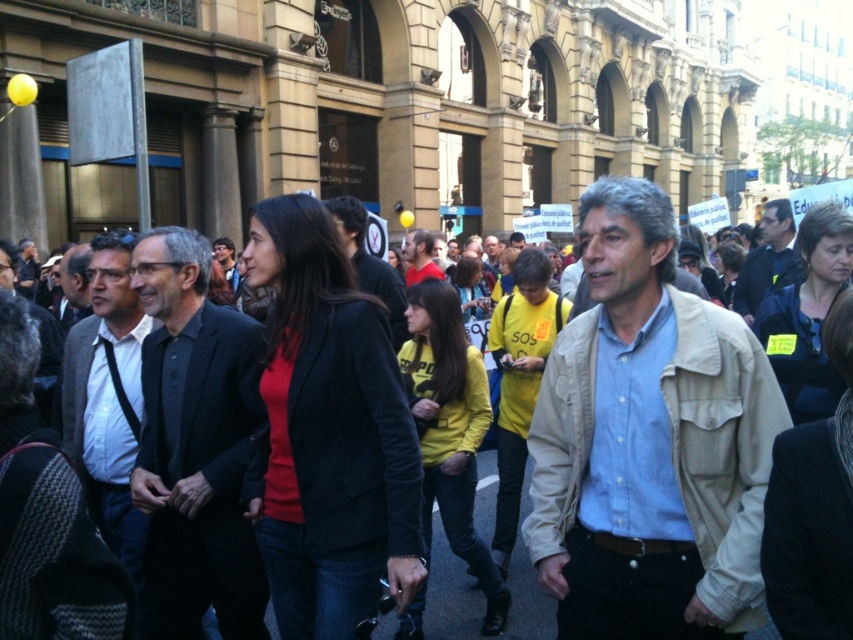
Question: Is matte black jacket at center to the left of matte red shirt at center from the viewer's perspective?

Choices:
 (A) yes
 (B) no

Answer: (A)

Question: Which object is the farthest from the dark blue shirt at center?

Choices:
 (A) dark gray suit at left
 (B) light beige jacket at center
 (C) matte red shirt at center

Answer: (A)

Question: Which of the following is the closest to the observer?

Choices:
 (A) light beige jacket at center
 (B) beige textured jacket at center

Answer: (B)

Question: Which of the following is the closest to the observer?

Choices:
 (A) dark gray suit at left
 (B) matte red shirt at center
 (C) beige textured jacket at center
 (D) yellow shirt at center

Answer: (C)

Question: Is beige textured jacket at center below dark gray suit at left?

Choices:
 (A) no
 (B) yes

Answer: (A)

Question: Is beige textured jacket at center to the left of matte red shirt at center from the viewer's perspective?

Choices:
 (A) yes
 (B) no

Answer: (B)